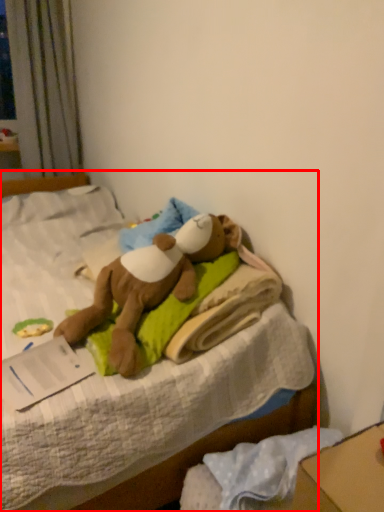
Question: From the image, what is the correct spatial relationship of bed (annotated by the red box) in relation to toy?

Choices:
 (A) right
 (B) left

Answer: (B)